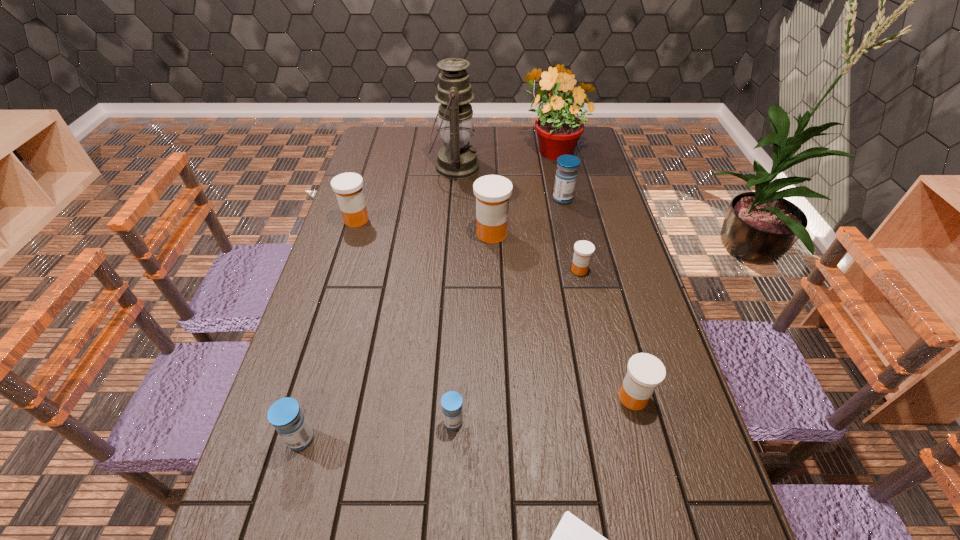
Locate an element on the screen. This screenshot has height=540, width=960. free space that satisfies the following two spatial constraints: 1. on the front side of the red flowerpot; 2. on the label of the tallest medicine is located at coordinates (571, 234).